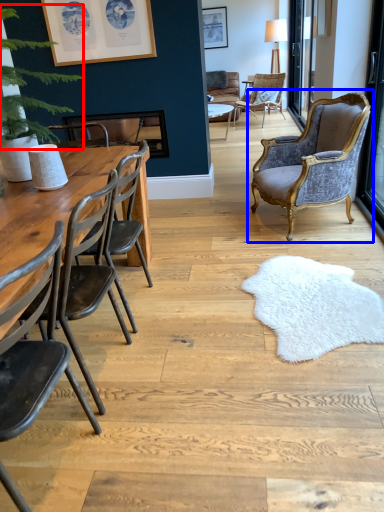
Question: Which of the following is the farthest to the observer, plant (highlighted by a red box) or chair (highlighted by a blue box)?

Choices:
 (A) plant
 (B) chair

Answer: (B)